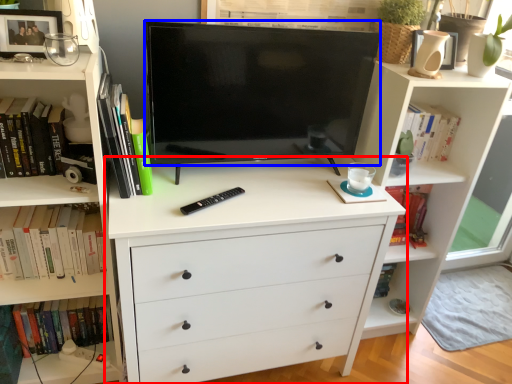
Question: Which of the following is the closest to the observer, chest of drawers (highlighted by a red box) or television (highlighted by a blue box)?

Choices:
 (A) chest of drawers
 (B) television

Answer: (B)